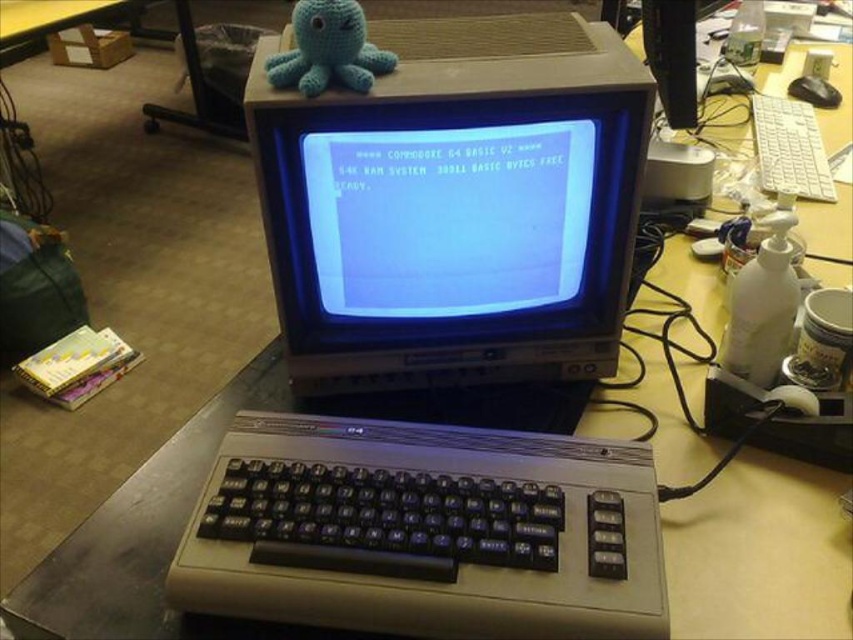
Which is below, matte plastic monitor at center or blue yarn octopus at upper center?

Positioned lower is matte plastic monitor at center.

The height and width of the screenshot is (640, 853). What do you see at coordinates (456, 204) in the screenshot?
I see `matte plastic monitor at center` at bounding box center [456, 204].

Who is more forward, [577,362] or [314,68]?

Point [314,68]

The image size is (853, 640). In order to click on matte plastic monitor at center in this screenshot , I will do `click(456, 204)`.

Can you confirm if blue yarn octopus at upper center is shorter than white plastic keyboard at upper right?

Correct, blue yarn octopus at upper center is not as tall as white plastic keyboard at upper right.

Is blue yarn octopus at upper center above white plastic keyboard at upper right?

Actually, blue yarn octopus at upper center is below white plastic keyboard at upper right.

Is point (363, 54) positioned before point (817, 150)?

That is True.

At what (x,y) coordinates should I click in order to perform the action: click on blue yarn octopus at upper center. Please return your answer as a coordinate pair (x, y). The height and width of the screenshot is (640, 853). Looking at the image, I should click on (328, 49).

Can you confirm if blue yarn octopus at upper center is positioned above black plastic mouse at upper right?

Actually, blue yarn octopus at upper center is below black plastic mouse at upper right.

Locate an element on the screen. This screenshot has height=640, width=853. blue yarn octopus at upper center is located at coordinates (328, 49).

Where is `blue yarn octopus at upper center`? The height and width of the screenshot is (640, 853). blue yarn octopus at upper center is located at coordinates (328, 49).